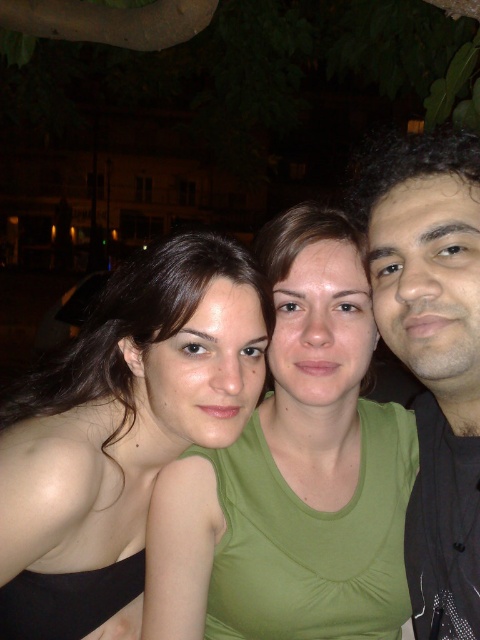
Consider the image. Does matte black tank top at center appear over black matte shirt at right?

Actually, matte black tank top at center is below black matte shirt at right.

Between matte black tank top at center and black matte shirt at right, which one has more height?

With more height is black matte shirt at right.

Is point (188, 317) closer to camera compared to point (446, 269)?

No.

Where is `matte black tank top at center`? The width and height of the screenshot is (480, 640). matte black tank top at center is located at coordinates (121, 428).

Can you confirm if green matte tank top at center is positioned below black matte shirt at right?

Yes, green matte tank top at center is below black matte shirt at right.

Where is `green matte tank top at center`? Image resolution: width=480 pixels, height=640 pixels. green matte tank top at center is located at coordinates (294, 472).

Where is `green matte tank top at center`? The image size is (480, 640). green matte tank top at center is located at coordinates (294, 472).

Is green matte tank top at center shorter than matte black tank top at center?

In fact, green matte tank top at center may be taller than matte black tank top at center.

Does green matte tank top at center have a lesser width compared to matte black tank top at center?

Yes, green matte tank top at center is thinner than matte black tank top at center.

Locate an element on the screen. This screenshot has width=480, height=640. green matte tank top at center is located at coordinates (294, 472).